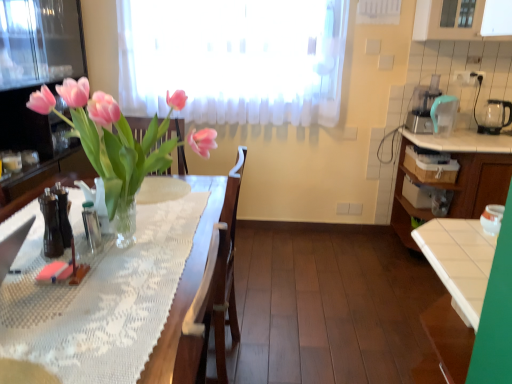
Question: Do you think transparent glass kettle at right, the 3th appliance in the bottom-to-top sequence, is within white glossy jar at right, marked as the first appliance in a front-to-back arrangement, or outside of it?

Choices:
 (A) outside
 (B) inside

Answer: (A)

Question: Is transparent glass kettle at right, the 3th appliance when ordered from front to back, to the left or to the right of white glossy jar at right, marked as the first appliance in a front-to-back arrangement, in the image?

Choices:
 (A) left
 (B) right

Answer: (B)

Question: Which of these objects is positioned farthest from the transparent glass kettle at right, the 3th appliance when ordered from front to back?

Choices:
 (A) teal plastic blender at upper right, marked as the second appliance in a bottom-to-top arrangement
 (B) white glossy jar at right, the first appliance positioned from the left
 (C) white glossy cabinet at right

Answer: (B)

Question: Which object is the closest to the white glossy jar at right, which appears as the 3th appliance when viewed from the back?

Choices:
 (A) teal plastic blender at upper right, marked as the 2th appliance in a back-to-front arrangement
 (B) white glossy cabinet at right
 (C) transparent glass kettle at right, arranged as the 1th appliance when viewed from the right

Answer: (B)